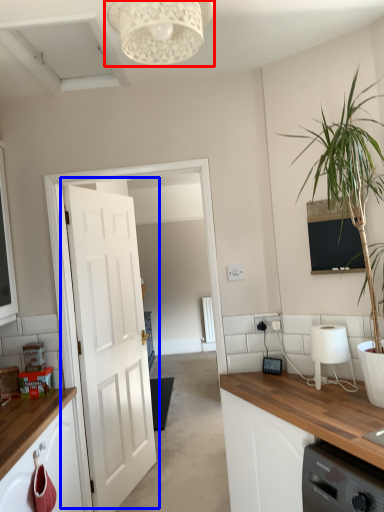
Question: Which object is closer to the camera taking this photo, light fixture (highlighted by a red box) or door (highlighted by a blue box)?

Choices:
 (A) light fixture
 (B) door

Answer: (A)